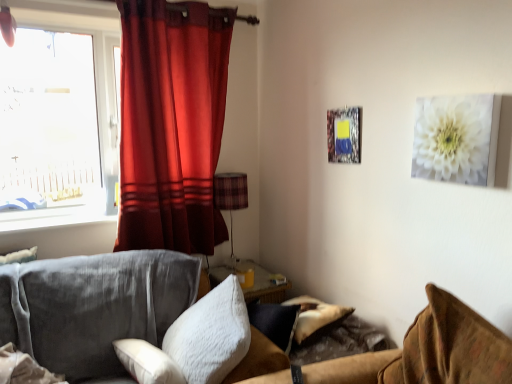
Question: Is satin red curtain at left positioned behind white matte canvas at upper right?

Choices:
 (A) yes
 (B) no

Answer: (A)

Question: Is satin red curtain at left facing towards white matte canvas at upper right?

Choices:
 (A) yes
 (B) no

Answer: (A)

Question: Can you confirm if satin red curtain at left is wider than white matte canvas at upper right?

Choices:
 (A) yes
 (B) no

Answer: (A)

Question: Is satin red curtain at left at the left side of white matte canvas at upper right?

Choices:
 (A) no
 (B) yes

Answer: (B)

Question: Does satin red curtain at left come in front of white matte canvas at upper right?

Choices:
 (A) yes
 (B) no

Answer: (B)

Question: Would you say satin red curtain at left is a long distance from white matte canvas at upper right?

Choices:
 (A) yes
 (B) no

Answer: (A)

Question: Would you say satin red curtain at left is outside velvet brown couch at lower right?

Choices:
 (A) no
 (B) yes

Answer: (B)

Question: Is satin red curtain at left at the left side of velvet brown couch at lower right?

Choices:
 (A) no
 (B) yes

Answer: (B)

Question: Is satin red curtain at left facing away from velvet brown couch at lower right?

Choices:
 (A) no
 (B) yes

Answer: (A)

Question: From a real-world perspective, is satin red curtain at left beneath velvet brown couch at lower right?

Choices:
 (A) no
 (B) yes

Answer: (A)

Question: From the image's perspective, does satin red curtain at left appear lower than velvet brown couch at lower right?

Choices:
 (A) yes
 (B) no

Answer: (B)

Question: Is satin red curtain at left wider than velvet brown couch at lower right?

Choices:
 (A) yes
 (B) no

Answer: (B)

Question: Considering the relative sizes of white fluffy pillow at center, the second pillow viewed from the left, and transparent glass window at upper left in the image provided, is white fluffy pillow at center, the second pillow viewed from the left, wider than transparent glass window at upper left?

Choices:
 (A) no
 (B) yes

Answer: (B)